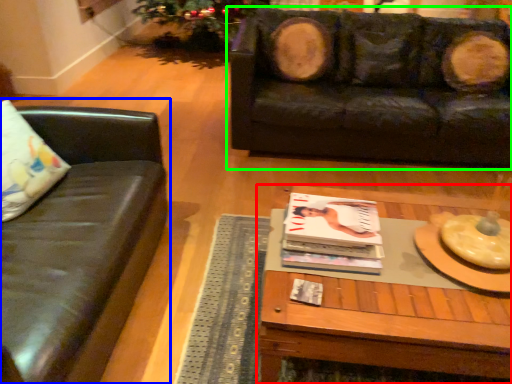
Question: Based on their relative distances, which object is farther from coffee table (highlighted by a red box)? Choose from studio couch (highlighted by a blue box) and studio couch (highlighted by a green box).

Choices:
 (A) studio couch
 (B) studio couch

Answer: (B)